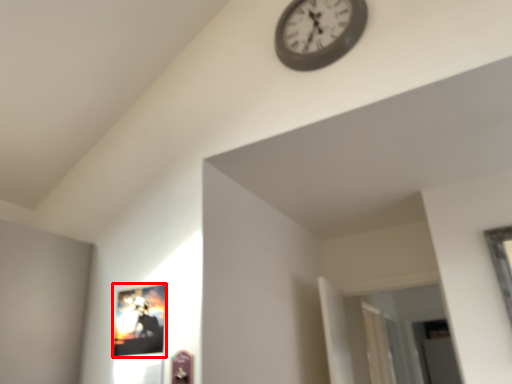
Question: From the image's perspective, where is picture frame (annotated by the red box) located in relation to wall clock in the image?

Choices:
 (A) below
 (B) above

Answer: (A)